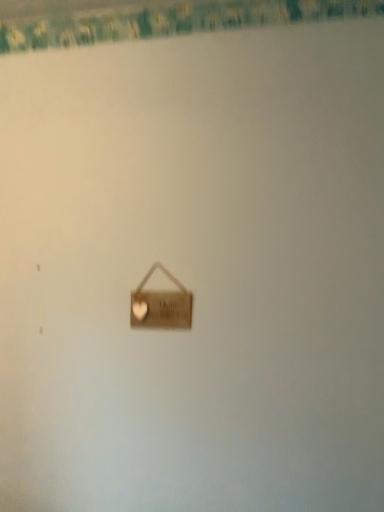
Question: Is point (339, 11) closer or farther from the camera than point (152, 301)?

Choices:
 (A) farther
 (B) closer

Answer: (A)

Question: Looking at their shapes, would you say green floral fabric at upper center is wider or thinner than wooden sign at center?

Choices:
 (A) thin
 (B) wide

Answer: (B)

Question: Would you say green floral fabric at upper center is to the left or to the right of wooden sign at center in the picture?

Choices:
 (A) left
 (B) right

Answer: (B)

Question: Is wooden sign at center inside or outside of green floral fabric at upper center?

Choices:
 (A) outside
 (B) inside

Answer: (A)

Question: Looking at their shapes, would you say wooden sign at center is wider or thinner than green floral fabric at upper center?

Choices:
 (A) wide
 (B) thin

Answer: (B)

Question: From a real-world perspective, relative to green floral fabric at upper center, is wooden sign at center vertically above or below?

Choices:
 (A) below
 (B) above

Answer: (A)

Question: In terms of height, does wooden sign at center look taller or shorter compared to green floral fabric at upper center?

Choices:
 (A) short
 (B) tall

Answer: (B)